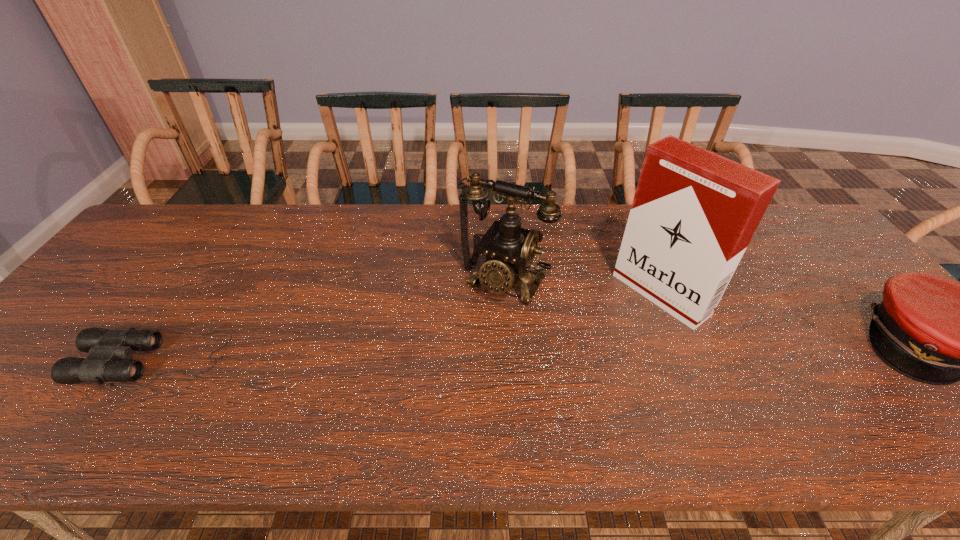
Identify the location of vacant region located on the front-facing side of the second object from right to left. The width and height of the screenshot is (960, 540). (617, 328).

This screenshot has height=540, width=960. Identify the location of vacant space situated 0.380m on the front-facing side of the second object from right to left. [x=525, y=395].

Locate an element on the screen. This screenshot has width=960, height=540. vacant space located 0.190m on the rotary dial of the telephone is located at coordinates (450, 358).

The width and height of the screenshot is (960, 540). Find the location of `blank area located on the rotary dial of the telephone`. blank area located on the rotary dial of the telephone is located at coordinates (467, 334).

Find the location of a particular element. This screenshot has height=540, width=960. vacant space located on the rotary dial of the telephone is located at coordinates (457, 349).

Where is `object that is at the near edge`? The width and height of the screenshot is (960, 540). object that is at the near edge is located at coordinates (106, 347).

Find the location of a particular element. Image resolution: width=960 pixels, height=540 pixels. object at the left edge is located at coordinates (106, 347).

Find the location of `object that is at the near left corner`. object that is at the near left corner is located at coordinates [x=106, y=347].

In the image, there is a desktop. Where is `vacant space at the far edge`? The image size is (960, 540). vacant space at the far edge is located at coordinates (506, 206).

Identify the location of vacant space at the near edge. (716, 379).